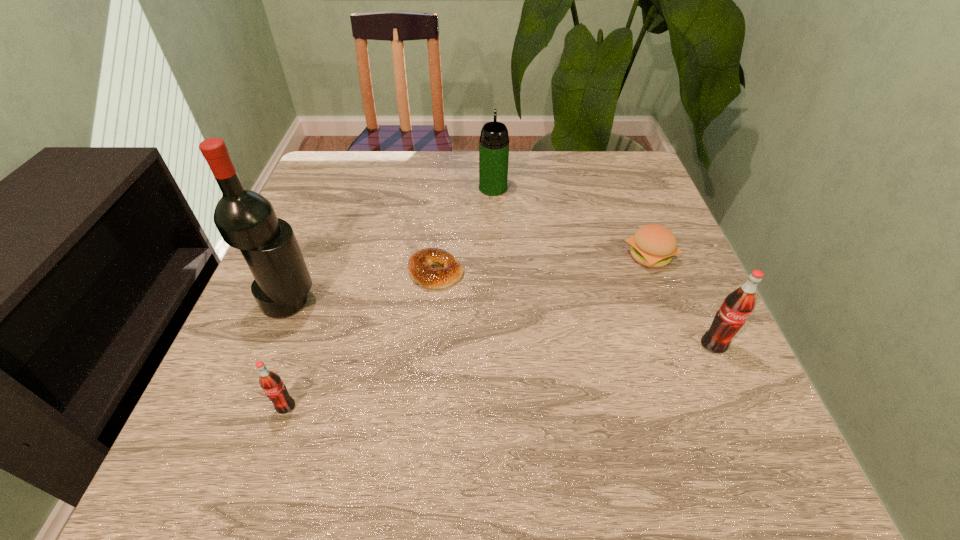
The width and height of the screenshot is (960, 540). I want to click on wine bottle positioned at the left edge, so click(x=246, y=220).

Find the location of `soda bottle at the right edge`. soda bottle at the right edge is located at coordinates (738, 305).

Find the location of `hamburger that is at the right edge`. hamburger that is at the right edge is located at coordinates click(653, 245).

Locate an element on the screen. The height and width of the screenshot is (540, 960). object that is at the near left corner is located at coordinates (271, 383).

In the image, there is a desktop. Identify the location of vacant space at the far edge. (387, 163).

In the image, there is a desktop. Where is `vacant space at the near edge`? Image resolution: width=960 pixels, height=540 pixels. vacant space at the near edge is located at coordinates coord(372,377).

The height and width of the screenshot is (540, 960). Find the location of `vacant space at the left edge of the desktop`. vacant space at the left edge of the desktop is located at coordinates pos(233,351).

You are a GUI agent. You are given a task and a screenshot of the screen. Output one action in this format:
    pyautogui.click(x=<x>, y=<y>)
    Task: Click on the vacant space at the right edge
    
    Given the screenshot: What is the action you would take?
    pos(702,318)

The width and height of the screenshot is (960, 540). In order to click on blank space at the far left corner in this screenshot , I will do click(x=324, y=169).

This screenshot has width=960, height=540. In order to click on free space at the near left corner of the desktop in this screenshot , I will do click(263, 407).